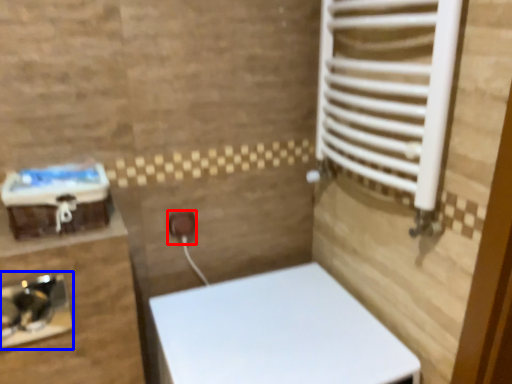
Question: Which object appears closest to the camera in this image, electric outlet (highlighted by a red box) or sink (highlighted by a blue box)?

Choices:
 (A) electric outlet
 (B) sink

Answer: (B)